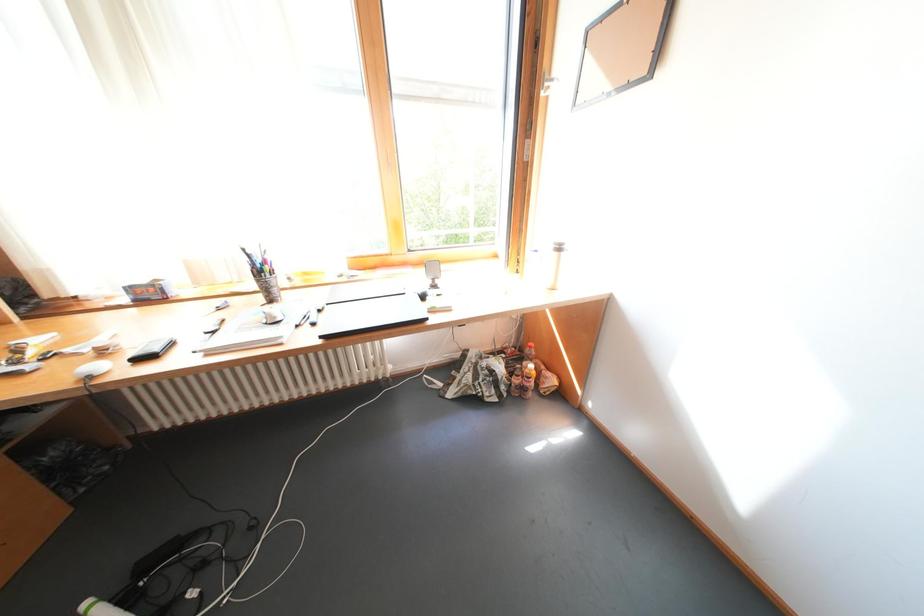
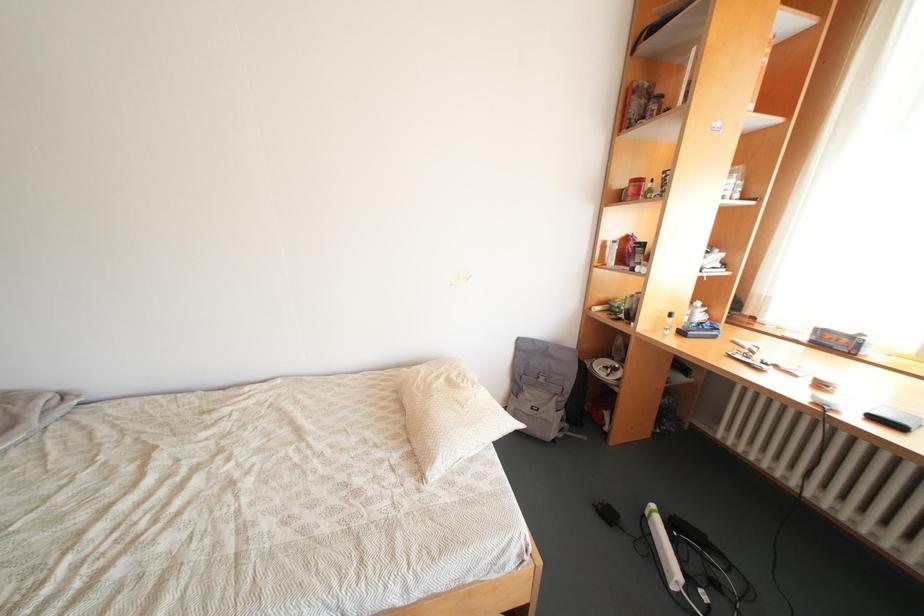
How did the camera likely rotate?

The camera's rotation is toward left-down.